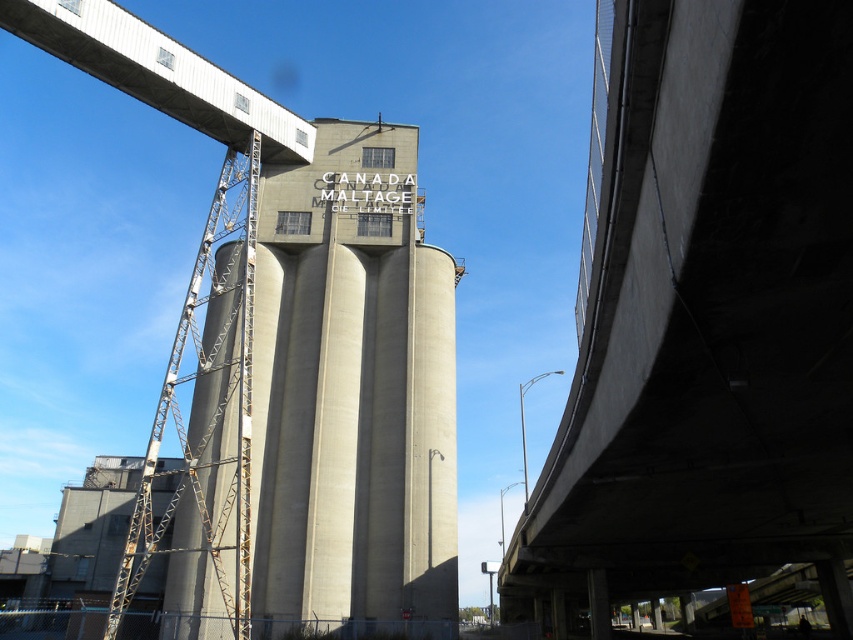
You are a photographer trying to capture the concrete silo at center without any obstructions. Given that you are positioned at the current viewpoint, can you adjust your position to avoid the concrete bridge at upper right blocking the view?

The concrete bridge at upper right is in front of the concrete silo at center, so moving your position might allow you to reposition yourself so the bridge is no longer between you and the silo, potentially by moving to the left or right to find an angle where the bridge does not obscure the view.

You are standing at the point closest to the silo. Which point, point (x=357, y=344) or point (x=93, y=61), is farther away from you?

Point (x=357, y=344) is farther away because it is behind point (x=93, y=61).

You are a city planner assessing the space between the concrete silo at center and the metallic gray bridge at upper left. Based on their sizes, would the silo block the view of the bridge from the street below?

The concrete silo at center might be wider than metallic gray bridge at upper left, so it could potentially block the view of the bridge from the street below depending on their exact dimensions and positioning.